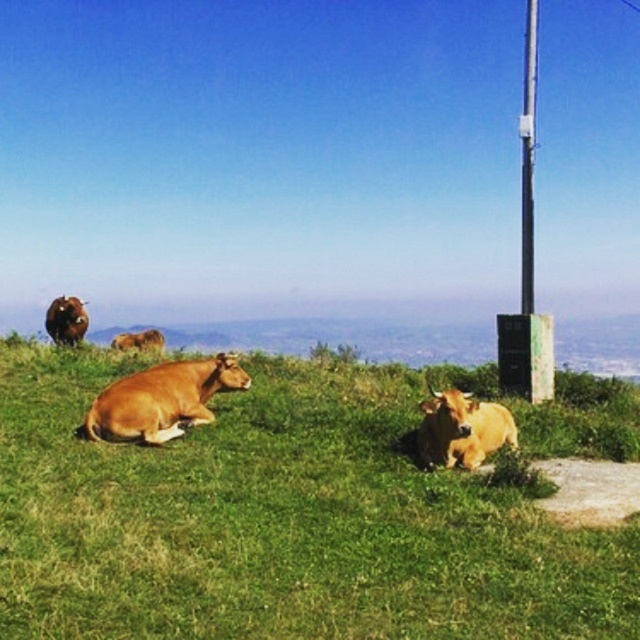
You are a farmer checking the pasture. You notice the green grass at center and the brown glossy cow at lower right. Which area has a wider spread?

The green grass at center has a wider spread than the brown glossy cow at lower right because its width is larger according to the description.

You are standing at the point marked by the coordinates point at (461, 429). Looking around, you see three cows. Which cow is directly in front of you at this point?

The point at (461, 429) corresponds to the brown glossy cow at lower right, so the brown glossy cow at lower right is directly in front of you at this point.